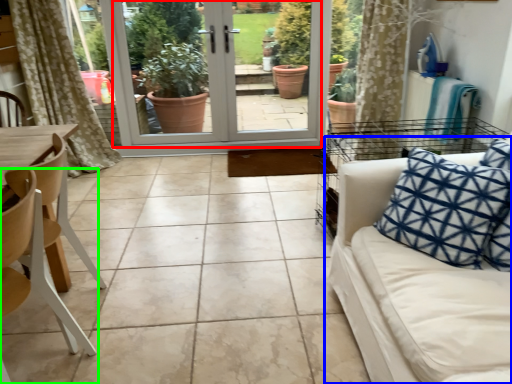
Question: Which object is the farthest from screen door (highlighted by a red box)? Choose among these: studio couch (highlighted by a blue box) or chair (highlighted by a green box).

Choices:
 (A) studio couch
 (B) chair

Answer: (B)